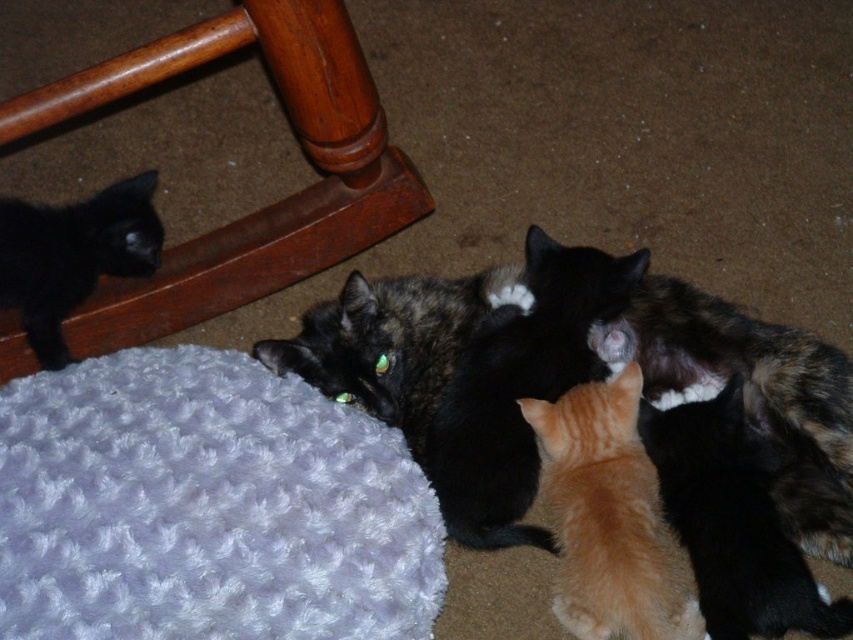
You are a cat owner who wants to place a small cat tree between the fluffy tortoiseshell cat at center and the black fur cat at left. Considering their sizes, which cat might need more space around them for comfort?

The fluffy tortoiseshell cat at center is much taller than the black fur cat at left, so it might need more space around them for comfort.

You are a cat owner who wants to place a new cat tree in the room. The wooden rocking chair at lower left is in front of the black fur cat at left. Considering their positions, where should you place the cat tree so it doesn

The wooden rocking chair at lower left is in front of the black fur cat at left. To avoid blocking the cat